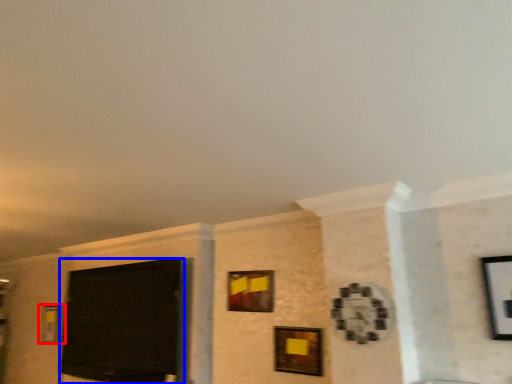
Question: Which point is further to the camera, picture frame (highlighted by a red box) or projection screen (highlighted by a blue box)?

Choices:
 (A) picture frame
 (B) projection screen

Answer: (A)